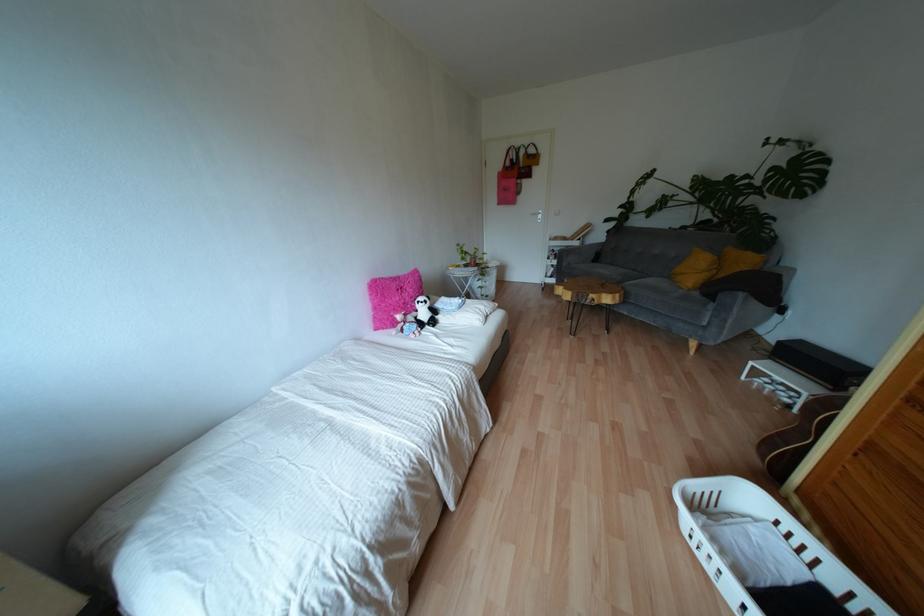
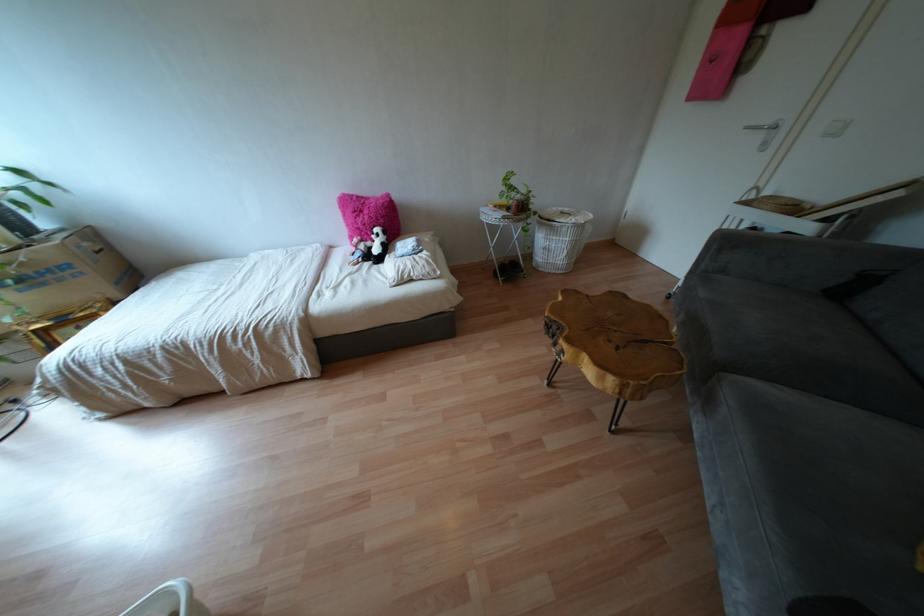
Where in the second image is the point corresponding to the point at 435,336 from the first image?

(349, 274)